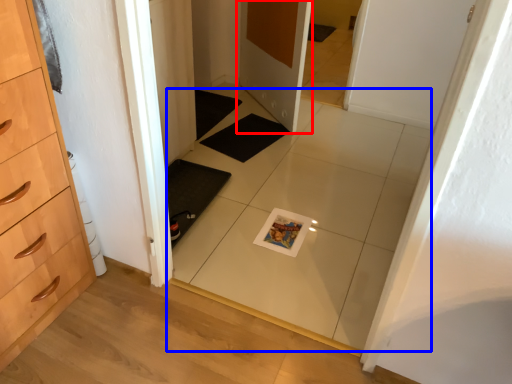
Question: Which point is further to the camera, door (highlighted by a red box) or tile (highlighted by a blue box)?

Choices:
 (A) door
 (B) tile

Answer: (A)